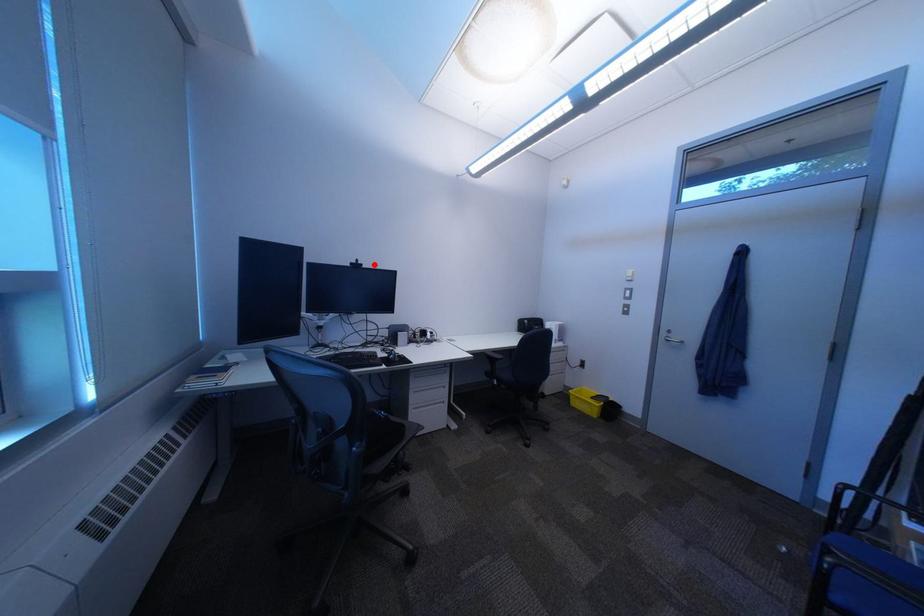
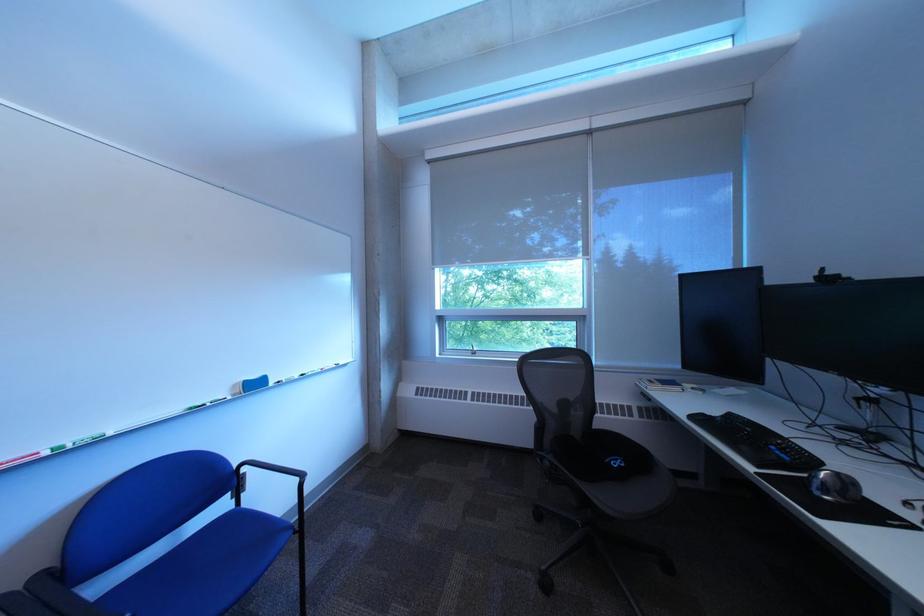
In the second image, find the point that corresponds to the highlighted location in the first image.

(843, 275)